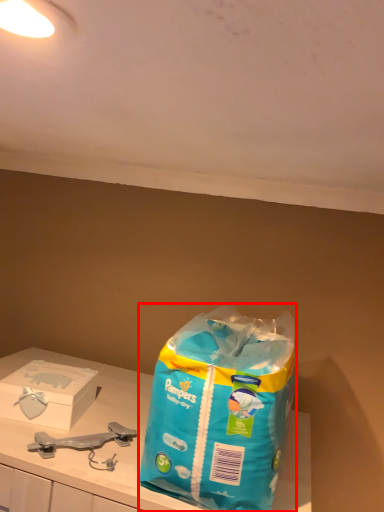
Question: From the image's perspective, what is the correct spatial relationship of shopping bag (annotated by the red box) in relation to box?

Choices:
 (A) below
 (B) above

Answer: (B)